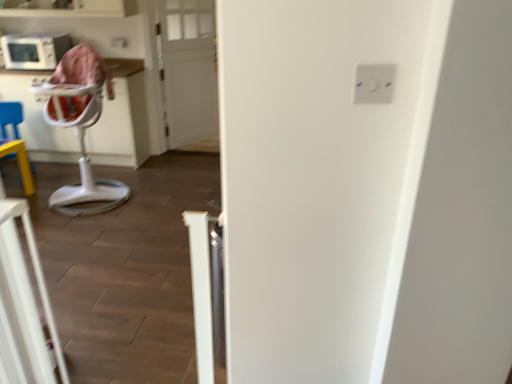
You are a GUI agent. You are given a task and a screenshot of the screen. Output one action in this format:
    pyautogui.click(x=<x>, y=<y>)
    Task: Click on the white plastic electric outlet at upper right
    
    Given the screenshot: What is the action you would take?
    pyautogui.click(x=373, y=83)

Describe the element at coordinates (80, 126) in the screenshot. I see `white plastic feeding chair at left` at that location.

Where is `white wooden door at center`? The image size is (512, 384). white wooden door at center is located at coordinates (187, 69).

From a real-world perspective, is white plastic highchair at left above or below white wooden door at center?

In terms of real-world spatial position, white plastic highchair at left is below white wooden door at center.

Is white plastic highchair at left outside of white wooden door at center?

white plastic highchair at left lies outside white wooden door at center's area.

Is white wooden door at center at the back of white plastic highchair at left?

white plastic highchair at left is not turned away from white wooden door at center.

From the image's perspective, does white plastic highchair at left appear lower than white wooden door at center?

Correct, white plastic highchair at left appears lower than white wooden door at center in the image.

In the scene shown: From a real-world perspective, relative to white plastic feeding chair at left, is white plastic electric outlet at upper right vertically above or below?

Clearly, from a real-world perspective, white plastic electric outlet at upper right is above white plastic feeding chair at left.

This screenshot has width=512, height=384. Identify the location of electric outlet to the right of white plastic feeding chair at left. (373, 83).

How many degrees apart are the facing directions of white plastic electric outlet at upper right and white plastic feeding chair at left?

They differ by 3.57 degrees in their facing directions.

Considering the positions of points (379, 96) and (72, 67), is point (379, 96) closer to camera compared to point (72, 67)?

Yes, point (379, 96) is in front of point (72, 67).

From a real-world perspective, is white plastic feeding chair at left on top of white wooden door at center?

Actually, white plastic feeding chair at left is physically below white wooden door at center in the real world.

Relative to white wooden door at center, is white plastic feeding chair at left in front or behind?

Clearly, white plastic feeding chair at left is in front of white wooden door at center.

Can you confirm if white plastic feeding chair at left is taller than white wooden door at center?

Incorrect, the height of white plastic feeding chair at left is not larger of that of white wooden door at center.

From the picture: Considering the relative sizes of white plastic feeding chair at left and white wooden door at center in the image provided, is white plastic feeding chair at left bigger than white wooden door at center?

Indeed, white plastic feeding chair at left has a larger size compared to white wooden door at center.

Considering the relative sizes of white wooden door at center and white plastic feeding chair at left in the image provided, is white wooden door at center smaller than white plastic feeding chair at left?

Correct, white wooden door at center occupies less space than white plastic feeding chair at left.

What's the angular difference between white wooden door at center and white plastic feeding chair at left's facing directions?

53.7 degrees separate the facing orientations of white wooden door at center and white plastic feeding chair at left.

Looking at this image, from the image's perspective, would you say white wooden door at center is shown under white plastic feeding chair at left?

No, from the image's perspective, white wooden door at center is not below white plastic feeding chair at left.

Between white wooden door at center and white plastic feeding chair at left, which one has larger width?

With larger width is white plastic feeding chair at left.

Is white plastic electric outlet at upper right next to white plastic highchair at left?

white plastic electric outlet at upper right and white plastic highchair at left are clearly separated.

You are a GUI agent. You are given a task and a screenshot of the screen. Output one action in this format:
    pyautogui.click(x=<x>, y=<y>)
    Task: Click on the furniture located on the left of white plastic electric outlet at upper right
    The width and height of the screenshot is (512, 384).
    Given the screenshot: What is the action you would take?
    pyautogui.click(x=28, y=291)

Which of these two, white plastic electric outlet at upper right or white plastic highchair at left, stands shorter?

Standing shorter between the two is white plastic electric outlet at upper right.

Can we say white wooden door at center lies outside white plastic highchair at left?

Yes, white wooden door at center is outside of white plastic highchair at left.

Between white wooden door at center and white plastic highchair at left, which one has less height?

A: white plastic highchair at left is shorter.

Looking at the image, does white wooden door at center seem bigger or smaller compared to white plastic highchair at left?

Clearly, white wooden door at center is larger in size than white plastic highchair at left.

Which of these two, white plastic feeding chair at left or white plastic electric outlet at upper right, stands shorter?

With less height is white plastic electric outlet at upper right.

Is white plastic feeding chair at left directly adjacent to white plastic electric outlet at upper right?

No, white plastic feeding chair at left is not in contact with white plastic electric outlet at upper right.

Who is bigger, white plastic feeding chair at left or white plastic electric outlet at upper right?

Bigger between the two is white plastic feeding chair at left.

You are a GUI agent. You are given a task and a screenshot of the screen. Output one action in this format:
    pyautogui.click(x=<x>, y=<y>)
    Task: Click on the furniture to the left of white wooden door at center
    Image resolution: width=512 pixels, height=384 pixels.
    Given the screenshot: What is the action you would take?
    pyautogui.click(x=28, y=291)

The image size is (512, 384). In order to click on feeding chair located underneath the white plastic electric outlet at upper right (from a real-world perspective) in this screenshot , I will do `click(80, 126)`.

When comparing their distances from white plastic feeding chair at left, does white plastic highchair at left or white wooden door at center seem closer?

white wooden door at center lies closer to white plastic feeding chair at left than the other object.

When comparing their distances from white plastic highchair at left, does white wooden door at center or white plastic feeding chair at left seem closer?

white plastic feeding chair at left lies closer to white plastic highchair at left than the other object.

When comparing their distances from white plastic highchair at left, does white plastic feeding chair at left or white plastic electric outlet at upper right seem closer?

white plastic electric outlet at upper right is positioned closer to the anchor white plastic highchair at left.

Based on their spatial positions, is white wooden door at center or white plastic feeding chair at left further from white plastic electric outlet at upper right?

The object further to white plastic electric outlet at upper right is white wooden door at center.

From the image, which object appears to be nearer to white wooden door at center, white plastic highchair at left or white plastic feeding chair at left?

white plastic feeding chair at left.

Based on their spatial positions, is white plastic feeding chair at left or white plastic highchair at left further from white wooden door at center?

white plastic highchair at left is positioned further to the anchor white wooden door at center.

When comparing their distances from white plastic electric outlet at upper right, does white plastic feeding chair at left or white plastic highchair at left seem closer?

Among the two, white plastic highchair at left is located nearer to white plastic electric outlet at upper right.

Based on their spatial positions, is white plastic highchair at left or white plastic electric outlet at upper right closer to white plastic feeding chair at left?

white plastic highchair at left is positioned closer to the anchor white plastic feeding chair at left.

The image size is (512, 384). Find the location of `furniture between white plastic electric outlet at upper right and white plastic feeding chair at left from front to back`. furniture between white plastic electric outlet at upper right and white plastic feeding chair at left from front to back is located at coordinates (28, 291).

The width and height of the screenshot is (512, 384). I want to click on feeding chair located between white plastic electric outlet at upper right and white wooden door at center in the depth direction, so click(x=80, y=126).

Image resolution: width=512 pixels, height=384 pixels. Find the location of `furniture between white plastic electric outlet at upper right and white wooden door at center in the front-back direction`. furniture between white plastic electric outlet at upper right and white wooden door at center in the front-back direction is located at coordinates (28, 291).

The width and height of the screenshot is (512, 384). I want to click on feeding chair located between white plastic highchair at left and white wooden door at center in the depth direction, so click(x=80, y=126).